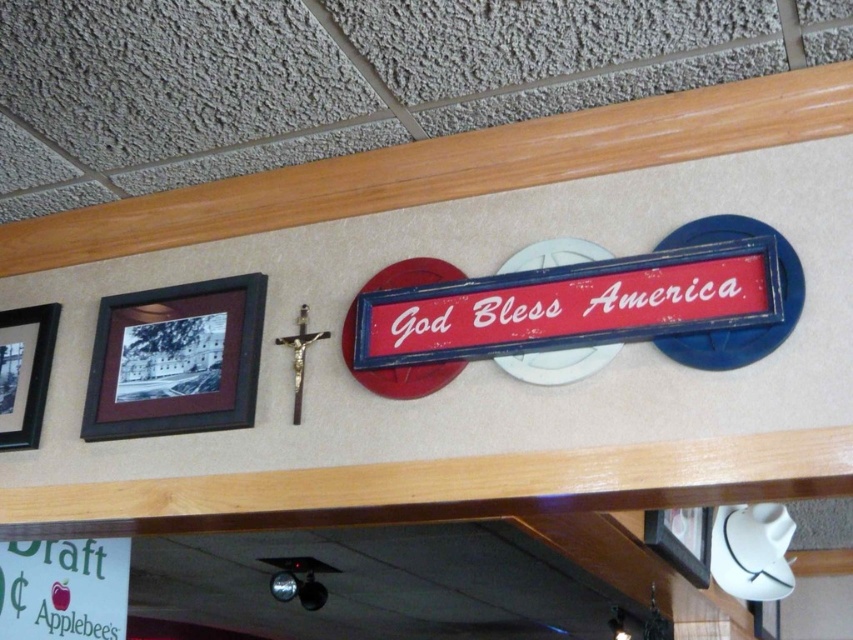
In the scene shown: You are hanging a new picture on the wall and want to place it exactly where the red painted wood sign at center is currently located. What are the coordinates of the spot where you should place your new picture?

The coordinates for the red painted wood sign at center are at point (572, 305), so you should place your new picture at those coordinates.